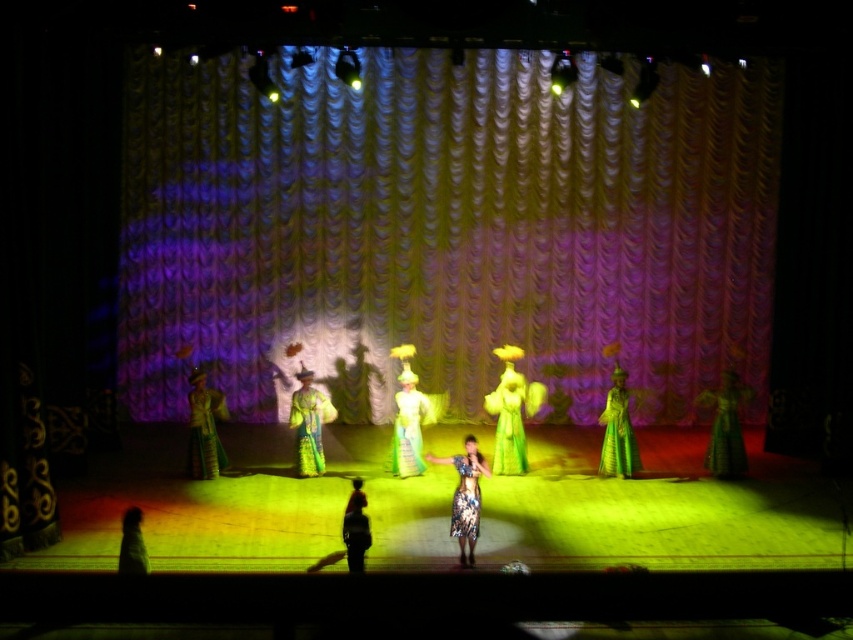
Is silk robe at left wider than floral fabric dress at center?

Yes.

Is silk robe at left to the left of floral fabric dress at center from the viewer's perspective?

Yes, silk robe at left is to the left of floral fabric dress at center.

Describe the element at coordinates (204, 428) in the screenshot. I see `silk robe at left` at that location.

You are a GUI agent. You are given a task and a screenshot of the screen. Output one action in this format:
    pyautogui.click(x=<x>, y=<y>)
    Task: Click on the silk robe at left
    
    Given the screenshot: What is the action you would take?
    pyautogui.click(x=204, y=428)

From the picture: Is green satin dress at center in front of silk green dress at center?

Yes, it is in front of silk green dress at center.

Is green satin dress at center smaller than silk green dress at center?

No, green satin dress at center is not smaller than silk green dress at center.

The height and width of the screenshot is (640, 853). Find the location of `green satin dress at center`. green satin dress at center is located at coordinates (512, 419).

Which is below, silk green dress at center or floral silk dress at center?

floral silk dress at center is lower down.

What do you see at coordinates (410, 417) in the screenshot?
I see `silk green dress at center` at bounding box center [410, 417].

Identify the location of silk green dress at center. The height and width of the screenshot is (640, 853). (410, 417).